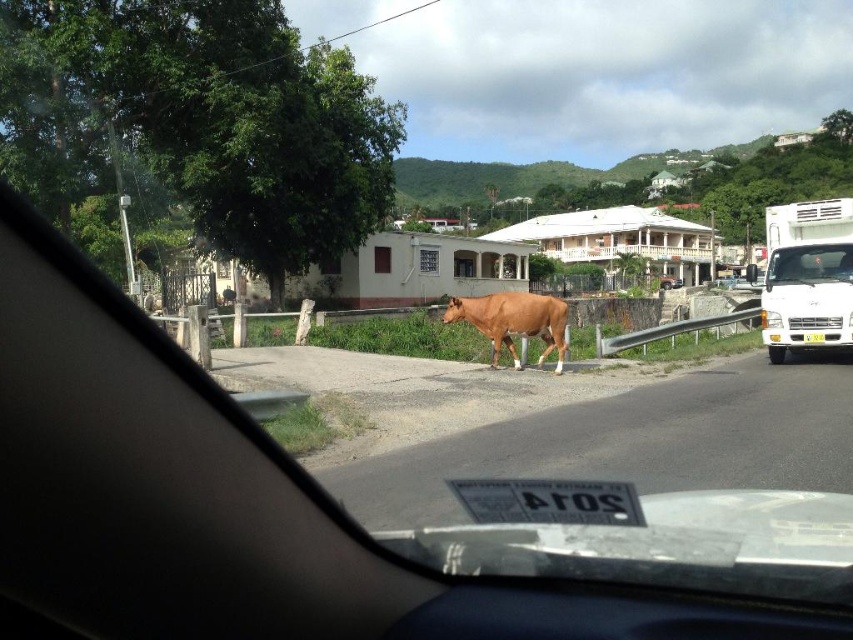
You are driving a matte white truck at center and need to park it in a space that can only accommodate vehicles up to the width of the white matte truck at right. Based on the scene, can your truck fit in the parking space?

The matte white truck at center might be wider than the white matte truck at right, so there is a possibility that it may not fit in the parking space designated for the narrower truck.

You are driving a car and see the white matte truck at right ahead on the road. Your car is 4.5 meters long. Can you safely make a U turn here without hitting the truck?

The distance between you and the white matte truck at right is 16.08 meters. Since your car requires at least half its length, around 2.25 meters, to complete a U turn, there is sufficient space. However, you must ensure the truck isn t moving towards you. If the truck is stationary, the distance is more than enough for a safe U turn.

You are driving a matte white truck at center and need to pass a brown glossy bull at center on the road. Given their sizes, which vehicle or animal should you be cautious about when maneuvering around?

The matte white truck at center is smaller than the brown glossy bull at center, so you should be cautious of the brown glossy bull at center due to its larger size when maneuvering around it.